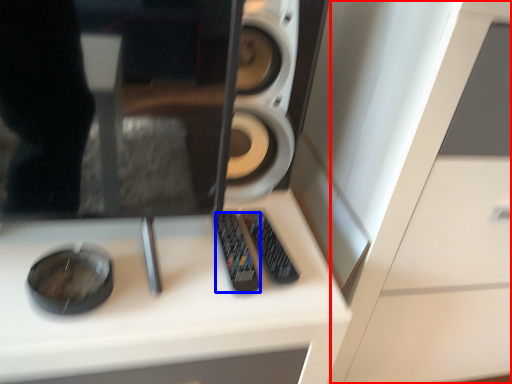
Question: Which object is further to the camera taking this photo, dresser (highlighted by a red box) or control (highlighted by a blue box)?

Choices:
 (A) dresser
 (B) control

Answer: (B)